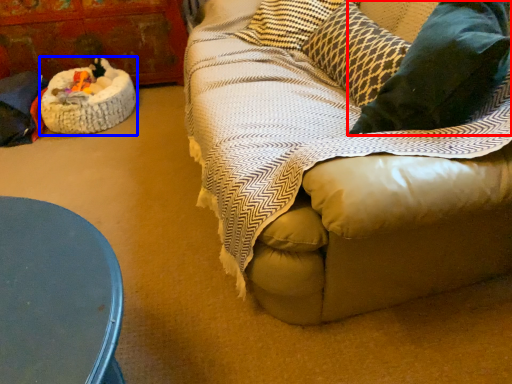
Question: Which object is closer to the camera taking this photo, throw pillow (highlighted by a red box) or cat bed (highlighted by a blue box)?

Choices:
 (A) throw pillow
 (B) cat bed

Answer: (A)